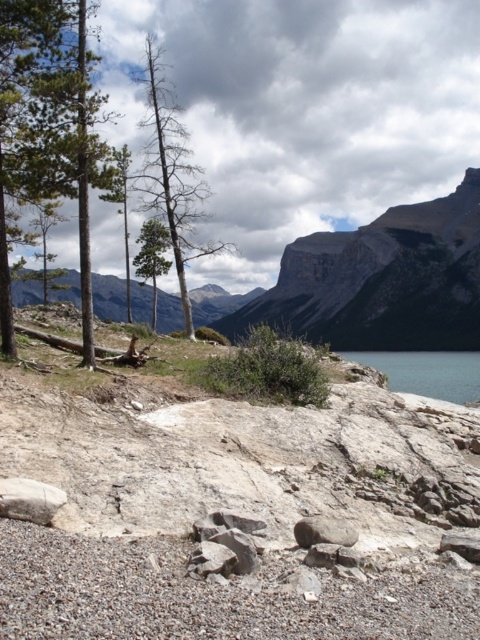
Question: Can you confirm if blue smooth water at lower right is positioned to the right of green matte tree at center?

Choices:
 (A) yes
 (B) no

Answer: (A)

Question: Which point is closer to the camera?

Choices:
 (A) (303, 321)
 (B) (146, 244)

Answer: (B)

Question: Is blue smooth water at lower right positioned before green matte tree at center?

Choices:
 (A) no
 (B) yes

Answer: (B)

Question: Among these objects, which one is nearest to the camera?

Choices:
 (A) blue smooth water at lower right
 (B) green matte tree at center
 (C) gray rock at center

Answer: (C)

Question: Can you confirm if rugged stone mountain at upper center is wider than green matte tree at center?

Choices:
 (A) yes
 (B) no

Answer: (A)

Question: Which object appears farthest from the camera in this image?

Choices:
 (A) gray rock at center
 (B) blue smooth water at lower right

Answer: (B)